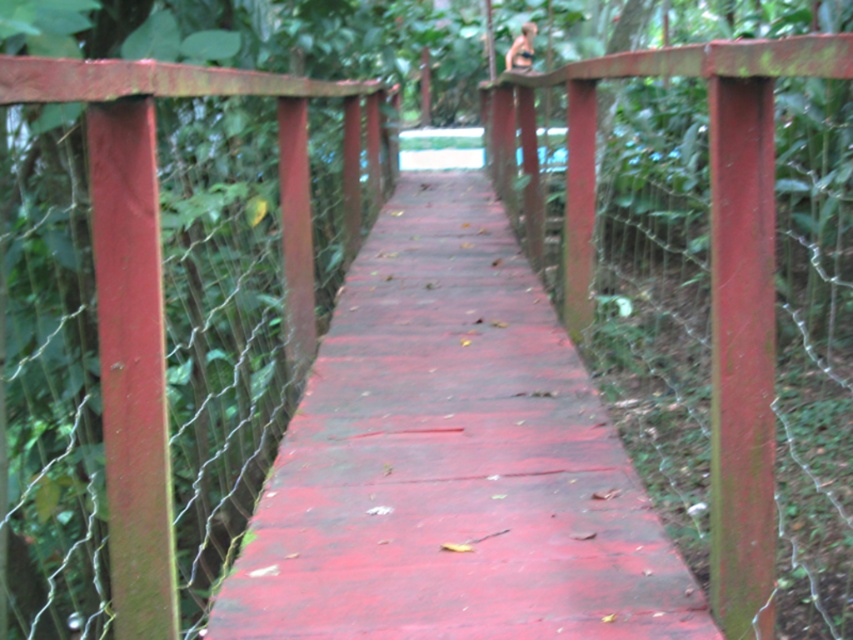
Who is more forward, (x=329, y=490) or (x=503, y=150)?

Point (x=329, y=490) is more forward.

Between point (463, 499) and point (732, 420), which one is positioned behind?

Positioned behind is point (463, 499).

What do you see at coordinates (451, 460) in the screenshot?
I see `smooth wooden bridge at center` at bounding box center [451, 460].

Identify the location of smooth wooden bridge at center. Image resolution: width=853 pixels, height=640 pixels. (451, 460).

Does rusty metal fence at upper center lie in front of rusty metal fence at left?

No, it is behind rusty metal fence at left.

Can you confirm if rusty metal fence at upper center is smaller than rusty metal fence at left?

Yes.

You are a GUI agent. You are given a task and a screenshot of the screen. Output one action in this format:
    pyautogui.click(x=<x>, y=<y>)
    Task: Click on the rusty metal fence at upper center
    The width and height of the screenshot is (853, 640).
    Given the screenshot: What is the action you would take?
    pyautogui.click(x=688, y=266)

Based on the photo, measure the distance between smooth wooden bridge at center and rusty metal fence at left.

smooth wooden bridge at center and rusty metal fence at left are 9.70 feet apart.

Can you confirm if smooth wooden bridge at center is positioned below rusty metal fence at left?

Incorrect, smooth wooden bridge at center is not positioned below rusty metal fence at left.

Where is `smooth wooden bridge at center`? smooth wooden bridge at center is located at coordinates (451, 460).

The height and width of the screenshot is (640, 853). I want to click on smooth wooden bridge at center, so click(x=451, y=460).